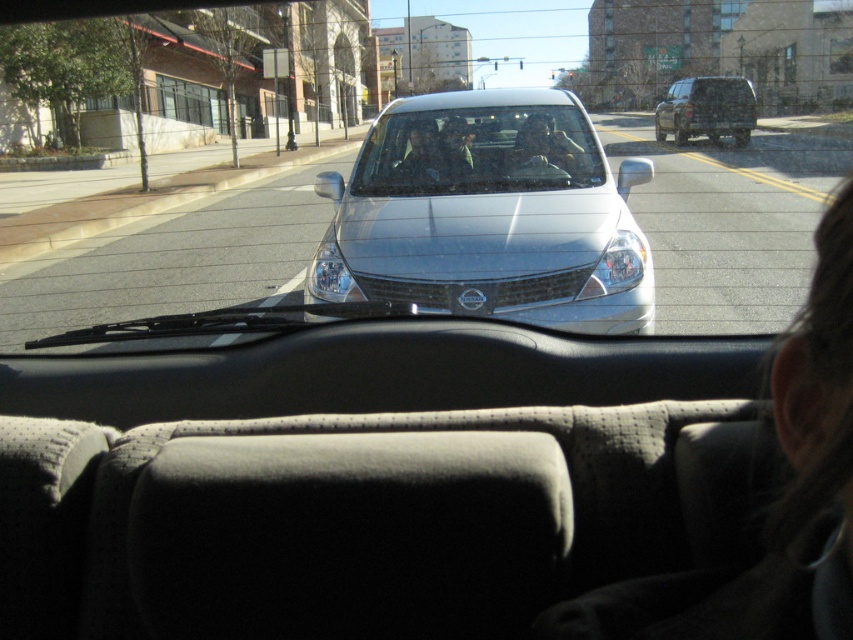
Question: Where is silver metallic car at center located in relation to clear glass windshield at center in the image?

Choices:
 (A) above
 (B) below

Answer: (A)

Question: From the image, what is the correct spatial relationship of clear glass windshield at center in relation to matte black minivan at upper right?

Choices:
 (A) above
 (B) below

Answer: (B)

Question: Which of the following is the farthest from the observer?

Choices:
 (A) silver metallic car at center
 (B) matte black minivan at upper right
 (C) clear glass windshield at center

Answer: (B)

Question: Observing the image, what is the correct spatial positioning of silver metallic car at center in reference to matte black minivan at upper right?

Choices:
 (A) right
 (B) left

Answer: (B)

Question: Which of the following is the farthest from the observer?

Choices:
 (A) clear glass windshield at center
 (B) silver metallic car at center
 (C) matte black minivan at upper right

Answer: (C)

Question: Which is nearer to the clear glass windshield at center?

Choices:
 (A) silver metallic car at center
 (B) matte black minivan at upper right

Answer: (A)